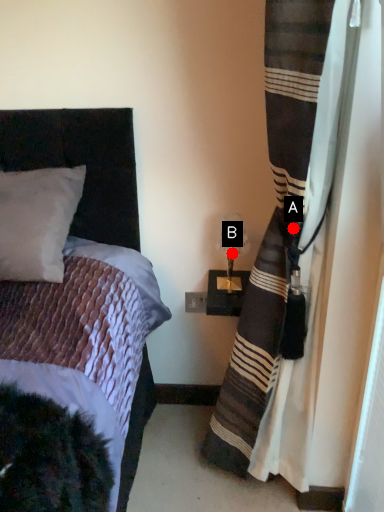
Question: Two points are circled on the image, labeled by A and B beside each circle. Which point is closer to the camera?

Choices:
 (A) A is closer
 (B) B is closer

Answer: (A)